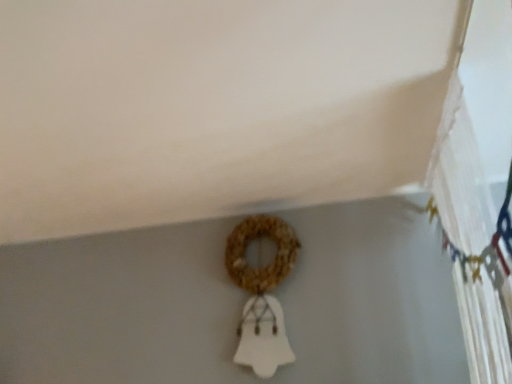
Measure the distance between white lace curtain at right and camera.

white lace curtain at right is 1.04 meters from camera.

Identify the location of white lace curtain at right. This screenshot has width=512, height=384. (479, 189).

What is the approximate height of white lace curtain at right?

It is 23.75 inches.

What is the approximate width of white lace curtain at right?

white lace curtain at right is 4.54 inches wide.

Image resolution: width=512 pixels, height=384 pixels. Describe the element at coordinates (479, 189) in the screenshot. I see `white lace curtain at right` at that location.

Find the location of `white lace curtain at right`. white lace curtain at right is located at coordinates (479, 189).